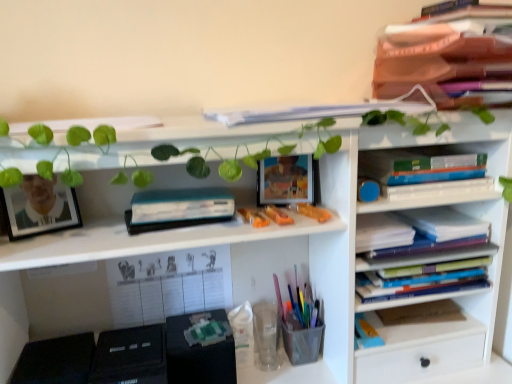
This screenshot has height=384, width=512. I want to click on teal matte paperback book at center, so click(x=178, y=209).

Describe the element at coordinates (302, 324) in the screenshot. I see `translucent plastic pen holder at center` at that location.

The width and height of the screenshot is (512, 384). Find the location of `matte orange book at upper right, which is the 9th book from bottom to top`. matte orange book at upper right, which is the 9th book from bottom to top is located at coordinates (442, 51).

Identify the location of hardcover books at center right, marked as the seventh book in a top-to-bottom arrangement. The image size is (512, 384). (421, 280).

Identify the location of the 7th book below the white paper at upper center, which appears as the 2th book when viewed from the top (from the image's perspective). (421, 313).

Is white paper at upper center, which appears as the 2th book when viewed from the top, directly adjacent to blue hardcover book at lower right, acting as the first book starting from the bottom?

No, white paper at upper center, which appears as the 2th book when viewed from the top, is not making contact with blue hardcover book at lower right, acting as the first book starting from the bottom.

Which is in front, point (256, 122) or point (431, 304)?

The point (256, 122) is more forward.

Considering the positions of point (23, 188) and point (323, 215), is point (23, 188) closer or farther from the camera than point (323, 215)?

Point (23, 188) is positioned closer to the camera compared to point (323, 215).

Considering the sizes of objects matte black picture frame at left and translucent plastic toy at upper center in the image provided, who is wider, matte black picture frame at left or translucent plastic toy at upper center?

Wider between the two is translucent plastic toy at upper center.

From a real-world perspective, is matte black picture frame at left physically located above or below translucent plastic toy at upper center?

matte black picture frame at left is situated higher than translucent plastic toy at upper center in the real world.

Does matte black picture frame at left touch translucent plastic toy at upper center?

There is a gap between matte black picture frame at left and translucent plastic toy at upper center.

Which of these two, blue hardcover book at center right, which ranks as the sixth book in bottom-to-top order, or hardcover books at right, which is the sixth book in top-to-bottom order, is wider?

With larger width is blue hardcover book at center right, which ranks as the sixth book in bottom-to-top order.

Is point (423, 221) closer or farther from the camera than point (438, 292)?

Point (423, 221).

Is blue hardcover book at center right, the 4th book when ordered from top to bottom, inside the boundaries of hardcover books at right, which is the sixth book in top-to-bottom order, or outside?

The correct answer is: outside.

At what (x,y) coordinates should I click in order to perform the action: click on the 3rd book to the right of the hardcover books at right, which is the sixth book in top-to-bottom order, starting your count from the anchor. Please return your answer as a coordinate pair (x, y). The width and height of the screenshot is (512, 384). Looking at the image, I should click on (444, 223).

From a real-world perspective, is translucent plastic toy at upper center positioned over teal matte paperback book at center based on gravity?

No, from a real-world perspective, translucent plastic toy at upper center is not over teal matte paperback book at center

Is translucent plastic toy at upper center positioned far away from teal matte paperback book at center?

That's not correct — translucent plastic toy at upper center is a little close to teal matte paperback book at center.

Is translucent plastic toy at upper center oriented away from teal matte paperback book at center?

No, translucent plastic toy at upper center's orientation is not away from teal matte paperback book at center.

Is blue hardcover book at lower right, acting as the first book starting from the bottom, facing towards blue hardcover book at center right, the 4th book when ordered from top to bottom?

No, blue hardcover book at lower right, acting as the first book starting from the bottom, is not facing towards blue hardcover book at center right, the 4th book when ordered from top to bottom.

Looking at the image, does blue hardcover book at lower right, the 9th book in the top-to-bottom sequence, seem bigger or smaller compared to blue hardcover book at center right, which ranks as the sixth book in bottom-to-top order?

Clearly, blue hardcover book at lower right, the 9th book in the top-to-bottom sequence, is smaller in size than blue hardcover book at center right, which ranks as the sixth book in bottom-to-top order.

Is blue hardcover book at lower right, the 9th book in the top-to-bottom sequence, in front of or behind blue hardcover book at center right, the 4th book when ordered from top to bottom, in the image?

Visually, blue hardcover book at lower right, the 9th book in the top-to-bottom sequence, is located behind blue hardcover book at center right, the 4th book when ordered from top to bottom.

Between blue hardcover book at lower right, the 9th book in the top-to-bottom sequence, and blue hardcover book at center right, the 4th book when ordered from top to bottom, which one has larger width?

blue hardcover book at center right, the 4th book when ordered from top to bottom, is wider.

From the image's perspective, count 3rd books upward from the translucent plastic toy at upper center and point to it. Please provide its 2D coordinates.

[(442, 51)]

Does matte orange book at upper right, which is the first book in top-to-bottom order, have a lesser width compared to translucent plastic toy at upper center?

No.

Considering their positions, is matte orange book at upper right, which is the 9th book from bottom to top, located in front of or behind translucent plastic toy at upper center?

In the image, matte orange book at upper right, which is the 9th book from bottom to top, appears in front of translucent plastic toy at upper center.

Can you see matte orange book at upper right, which is the first book in top-to-bottom order, touching translucent plastic toy at upper center?

They are not placed beside each other.

Is hardcover books at center right, the third book ordered from the bottom, facing away from hardcover book at upper right, marked as the 7th book in a bottom-to-top arrangement?

No.

From a real-world perspective, which is physically below, hardcover books at center right, marked as the seventh book in a top-to-bottom arrangement, or hardcover book at upper right, which appears as the 3th book when viewed from the top?

hardcover books at center right, marked as the seventh book in a top-to-bottom arrangement, from a real-world perspective.

From the image's perspective, is hardcover books at center right, marked as the seventh book in a top-to-bottom arrangement, over hardcover book at upper right, which appears as the 3th book when viewed from the top?

No, from the image's perspective, hardcover books at center right, marked as the seventh book in a top-to-bottom arrangement, is not over hardcover book at upper right, which appears as the 3th book when viewed from the top.

Does hardcover books at center right, marked as the seventh book in a top-to-bottom arrangement, lie in front of hardcover book at upper right, which appears as the 3th book when viewed from the top?

No, the depth of hardcover books at center right, marked as the seventh book in a top-to-bottom arrangement, is greater than that of hardcover book at upper right, which appears as the 3th book when viewed from the top.

From the blue hardcover book at lower right, the 9th book in the top-to-bottom sequence, count the 5th book to the left and point to it. Please provide its 2D coordinates.

[(312, 112)]

The height and width of the screenshot is (384, 512). I want to click on picture frame lying above the translucent plastic toy at upper center (from the image's perspective), so click(x=39, y=207).

Based on their spatial positions, is matte black picture frame at left or translucent plastic toy at upper center further from hardcover books at center right, marked as the seventh book in a top-to-bottom arrangement?

matte black picture frame at left lies further to hardcover books at center right, marked as the seventh book in a top-to-bottom arrangement, than the other object.

When comparing their distances from translucent plastic toy at upper center, does blue hardcover book at lower right, the 9th book in the top-to-bottom sequence, or hardcover books at center right, the third book ordered from the bottom, seem further?

blue hardcover book at lower right, the 9th book in the top-to-bottom sequence.

Estimate the real-world distances between objects in this image. Which object is further from matte orange book at upper right, which is the 9th book from bottom to top, blue hardcover book at lower right, acting as the first book starting from the bottom, or matte black picture frame at left?

Among the two, matte black picture frame at left is located further to matte orange book at upper right, which is the 9th book from bottom to top.

Based on their spatial positions, is white paper calendar at center, which is the 2th book in bottom-to-top order, or translucent plastic pen holder at center further from hardcover books at right, which is the sixth book in top-to-bottom order?

white paper calendar at center, which is the 2th book in bottom-to-top order, is positioned further to the anchor hardcover books at right, which is the sixth book in top-to-bottom order.

In the scene shown: Based on their spatial positions, is white matte bookshelf at upper center or hardcover book at upper right, which appears as the 3th book when viewed from the top, closer to translucent plastic toy at upper center?

Among the two, hardcover book at upper right, which appears as the 3th book when viewed from the top, is located nearer to translucent plastic toy at upper center.

Estimate the real-world distances between objects in this image. Which object is further from translucent plastic pen holder at center, matte black picture frame at left or blue hardcover book at right, acting as the 5th book starting from the top?

matte black picture frame at left is further to translucent plastic pen holder at center.

Based on the photo, estimate the real-world distances between objects in this image. Which object is closer to hardcover books at right, which is the sixth book in top-to-bottom order, white matte bookshelf at upper center or blue hardcover book at center right, which ranks as the sixth book in bottom-to-top order?

blue hardcover book at center right, which ranks as the sixth book in bottom-to-top order, is closer to hardcover books at right, which is the sixth book in top-to-bottom order.

Considering their positions, is blue hardcover book at right, acting as the 5th book starting from the top, positioned closer to white paper calendar at center, which appears as the 8th book when viewed from the top, than hardcover books at center right, marked as the seventh book in a top-to-bottom arrangement?

hardcover books at center right, marked as the seventh book in a top-to-bottom arrangement, is positioned closer to the anchor white paper calendar at center, which appears as the 8th book when viewed from the top.

Where is `toy between teal matte paperback book at center and hardcover book at upper right, which appears as the 3th book when viewed from the top`? This screenshot has width=512, height=384. toy between teal matte paperback book at center and hardcover book at upper right, which appears as the 3th book when viewed from the top is located at coordinates (310, 211).

You are a GUI agent. You are given a task and a screenshot of the screen. Output one action in this format:
    pyautogui.click(x=<x>, y=<y>)
    Task: Click on the shelf between teal matte paperback book at center and blue hardcover book at lower right, the 9th book in the top-to-bottom sequence, in the horizontal direction
    The image size is (512, 384).
    Given the screenshot: What is the action you would take?
    pyautogui.click(x=255, y=253)

The height and width of the screenshot is (384, 512). Find the location of `shelf between matte black picture frame at left and blue hardcover book at lower right, acting as the first book starting from the bottom, from left to right`. shelf between matte black picture frame at left and blue hardcover book at lower right, acting as the first book starting from the bottom, from left to right is located at coordinates (255, 253).

Image resolution: width=512 pixels, height=384 pixels. I want to click on shelf located between matte black picture frame at left and blue hardcover book at right, acting as the 5th book starting from the top, in the left-right direction, so click(255, 253).